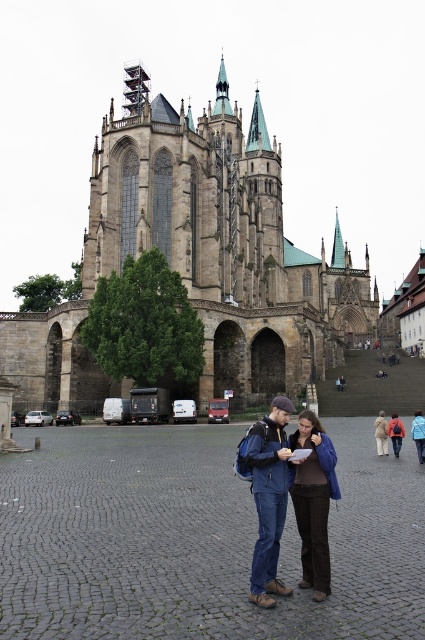
Is brown stone church at upper center to the left of denim jacket at center from the viewer's perspective?

Yes, brown stone church at upper center is to the left of denim jacket at center.

Which is more to the left, brown stone church at upper center or denim jacket at center?

brown stone church at upper center is more to the left.

Describe the element at coordinates (198, 260) in the screenshot. The width and height of the screenshot is (425, 640). I see `brown stone church at upper center` at that location.

The image size is (425, 640). What are the coordinates of `brown stone church at upper center` in the screenshot? It's located at (198, 260).

Does point (218, 163) come farther from viewer compared to point (422, 426)?

Yes, it is behind point (422, 426).

Who is positioned more to the right, brown stone church at upper center or brown leather jacket at center?

brown leather jacket at center is more to the right.

Between point (229, 241) and point (419, 458), which one is positioned behind?

The point (229, 241) is behind.

This screenshot has width=425, height=640. In order to click on brown stone church at upper center in this screenshot , I will do `click(198, 260)`.

Is point (263, 452) positioned in front of point (397, 456)?

Yes, point (263, 452) is closer to viewer.

Does denim jacket at center have a larger size compared to brown leather jacket at center?

No.

The image size is (425, 640). Identify the location of denim jacket at center. (x=269, y=499).